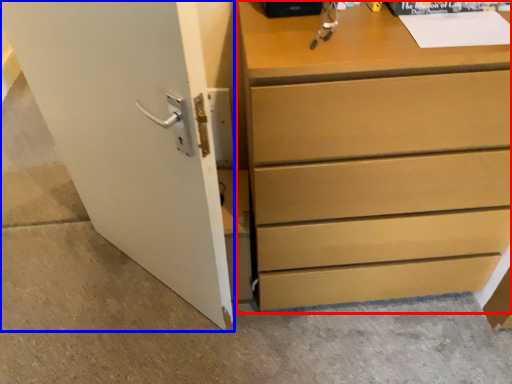
Question: Which of the following is the farthest to the observer, chest of drawers (highlighted by a red box) or door (highlighted by a blue box)?

Choices:
 (A) chest of drawers
 (B) door

Answer: (A)